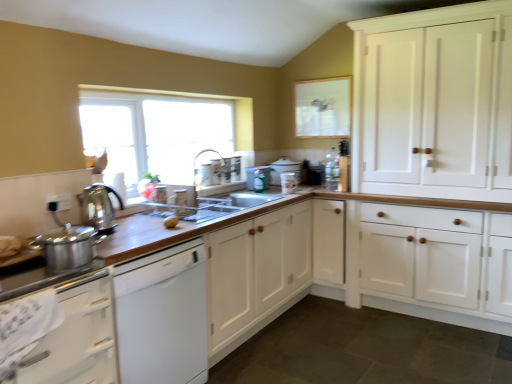
Question: Can you confirm if satin silver kettle at left, acting as the 6th appliance starting from the back, is thinner than shiny metallic pot at left?

Choices:
 (A) no
 (B) yes

Answer: (B)

Question: Is satin silver kettle at left, positioned as the 1th appliance in front-to-back order, beside shiny metallic pot at left?

Choices:
 (A) yes
 (B) no

Answer: (B)

Question: Does satin silver kettle at left, the first appliance from the left, lie behind shiny metallic pot at left?

Choices:
 (A) yes
 (B) no

Answer: (A)

Question: Does satin silver kettle at left, positioned as the 1th appliance in front-to-back order, have a lesser height compared to shiny metallic pot at left?

Choices:
 (A) no
 (B) yes

Answer: (A)

Question: Is satin silver kettle at left, positioned as the 6th appliance in right-to-left order, facing towards shiny metallic pot at left?

Choices:
 (A) yes
 (B) no

Answer: (B)

Question: Is shiny metallic pot at left at the back of satin silver kettle at left, the first appliance from the left?

Choices:
 (A) no
 (B) yes

Answer: (A)

Question: Is white wood cabinet at center, the 2th cabinetry from the left, further to camera compared to matte white mug at upper center, which is the fourth appliance in back-to-front order?

Choices:
 (A) yes
 (B) no

Answer: (B)

Question: Can you confirm if white wood cabinet at center, which is counted as the 2th cabinetry, starting from the right, is shorter than matte white mug at upper center, acting as the third appliance starting from the front?

Choices:
 (A) yes
 (B) no

Answer: (B)

Question: From the image's perspective, is white wood cabinet at center, which is counted as the 2th cabinetry, starting from the right, located above matte white mug at upper center, acting as the third appliance starting from the front?

Choices:
 (A) no
 (B) yes

Answer: (A)

Question: Can we say white wood cabinet at center, which is counted as the 2th cabinetry, starting from the right, lies outside matte white mug at upper center, acting as the third appliance starting from the front?

Choices:
 (A) no
 (B) yes

Answer: (B)

Question: Is matte white mug at upper center, which is the 5th appliance from left to right, inside white wood cabinet at center, which is counted as the 2th cabinetry, starting from the right?

Choices:
 (A) no
 (B) yes

Answer: (A)

Question: Is white wood cabinet at center, the 2th cabinetry from the left, thinner than matte white mug at upper center, acting as the third appliance starting from the front?

Choices:
 (A) yes
 (B) no

Answer: (B)

Question: From the image's perspective, does clear glass window screen at upper center appear lower than satin silver kettle at left, positioned as the 6th appliance in right-to-left order?

Choices:
 (A) yes
 (B) no

Answer: (B)